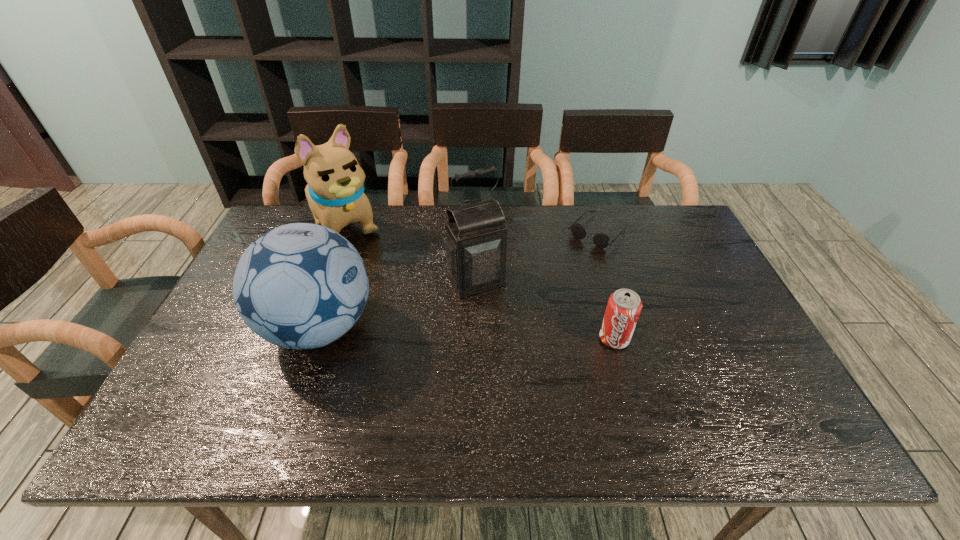
Identify the location of puppy that is at the left edge. Image resolution: width=960 pixels, height=540 pixels. (335, 192).

What are the coordinates of `object situated at the far left corner` in the screenshot? It's located at (335, 192).

The height and width of the screenshot is (540, 960). In order to click on object at the near left corner in this screenshot , I will do `click(300, 286)`.

Where is `free space at the far edge of the desktop`? This screenshot has height=540, width=960. free space at the far edge of the desktop is located at coordinates (544, 227).

Identify the location of blank space at the near edge of the desktop. (572, 377).

Where is `vacant space at the right edge of the desktop`? The height and width of the screenshot is (540, 960). vacant space at the right edge of the desktop is located at coordinates (737, 323).

This screenshot has height=540, width=960. In the image, there is a desktop. In order to click on vacant space at the near right corner in this screenshot , I will do `click(723, 397)`.

Where is `free space between the lantern and the puppy`? free space between the lantern and the puppy is located at coordinates (410, 254).

The height and width of the screenshot is (540, 960). Identify the location of unoccupied position between the soccer ball and the second shortest object. (467, 333).

Identify the location of vacant space that is in between the third tallest object and the lantern. (397, 303).